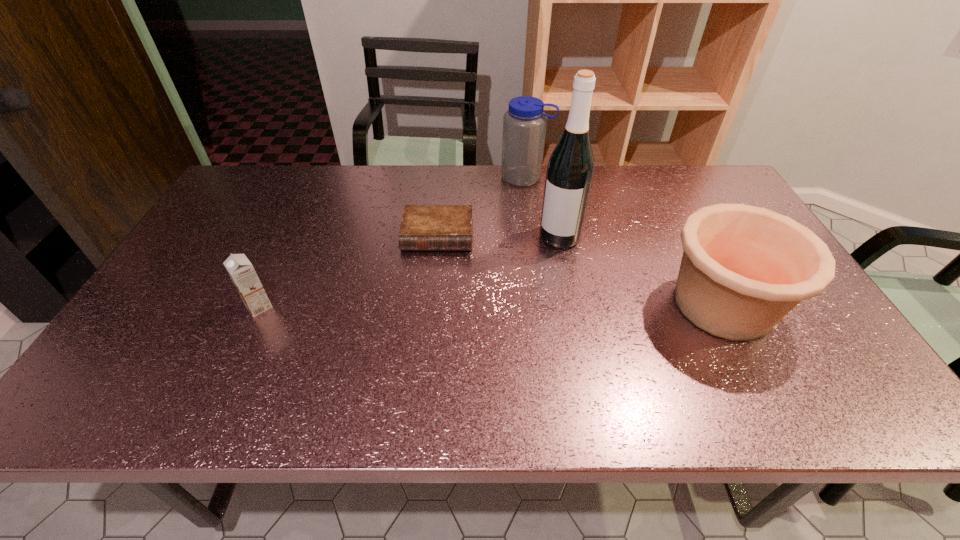
Locate an element on the screen. This screenshot has width=960, height=540. free space that is in between the water bottle and the pottery is located at coordinates (624, 241).

Image resolution: width=960 pixels, height=540 pixels. In order to click on blank region between the fourth tallest object and the water bottle in this screenshot , I will do `click(392, 242)`.

Find the location of `empty space that is in between the diary and the water bottle`. empty space that is in between the diary and the water bottle is located at coordinates (482, 207).

You are a GUI agent. You are given a task and a screenshot of the screen. Output one action in this format:
    pyautogui.click(x=<x>, y=<y>)
    Task: Click on the free spot between the farthest object and the rightmost object
    The height and width of the screenshot is (540, 960).
    Given the screenshot: What is the action you would take?
    pyautogui.click(x=624, y=241)

Find the location of a particular element. free space between the farthest object and the shortest object is located at coordinates point(482,207).

The width and height of the screenshot is (960, 540). Find the location of `free space between the fourth object from right to left and the rightmost object`. free space between the fourth object from right to left and the rightmost object is located at coordinates (580, 270).

The image size is (960, 540). In order to click on free spot between the third shortest object and the wine bottle in this screenshot , I will do `click(641, 271)`.

Locate an element on the screen. This screenshot has height=540, width=960. free spot between the water bottle and the chocolate milk is located at coordinates (392, 242).

Find the location of a particular element. The width and height of the screenshot is (960, 540). free spot between the water bottle and the diary is located at coordinates (482, 207).

This screenshot has height=540, width=960. I want to click on object that is the closest to the pottery, so click(570, 170).